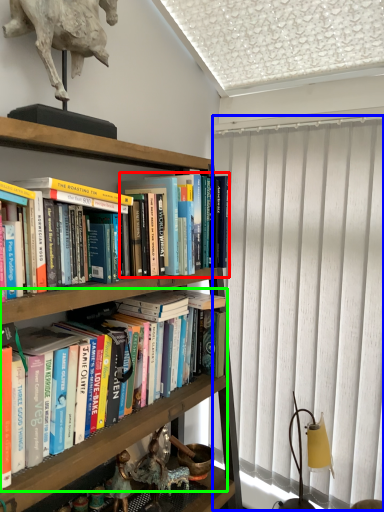
Question: Which object is positioned closest to book (highlighted by a red box)? Select from curtain (highlighted by a blue box) and book (highlighted by a green box).

Choices:
 (A) curtain
 (B) book

Answer: (A)